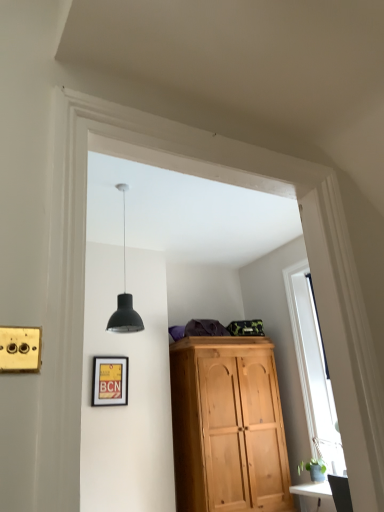
Question: Is matte black lampshade at center positioned behind matte yellow picture frame at lower left?

Choices:
 (A) yes
 (B) no

Answer: (B)

Question: Is matte black lampshade at center completely or partially outside of matte yellow picture frame at lower left?

Choices:
 (A) no
 (B) yes

Answer: (B)

Question: Does matte black lampshade at center have a greater width compared to matte yellow picture frame at lower left?

Choices:
 (A) no
 (B) yes

Answer: (A)

Question: Could you tell me if matte black lampshade at center is facing matte yellow picture frame at lower left?

Choices:
 (A) yes
 (B) no

Answer: (B)

Question: Does matte black lampshade at center lie in front of matte yellow picture frame at lower left?

Choices:
 (A) yes
 (B) no

Answer: (A)

Question: From the image's perspective, is matte black lampshade at center below matte yellow picture frame at lower left?

Choices:
 (A) yes
 (B) no

Answer: (B)

Question: From the image's perspective, is matte black lampshade at center over transparent glass window at right?

Choices:
 (A) no
 (B) yes

Answer: (B)

Question: Does matte black lampshade at center have a larger size compared to transparent glass window at right?

Choices:
 (A) no
 (B) yes

Answer: (A)

Question: Is matte black lampshade at center to the right of transparent glass window at right from the viewer's perspective?

Choices:
 (A) yes
 (B) no

Answer: (B)

Question: Is matte black lampshade at center facing towards transparent glass window at right?

Choices:
 (A) no
 (B) yes

Answer: (A)

Question: From a real-world perspective, is matte black lampshade at center on top of transparent glass window at right?

Choices:
 (A) no
 (B) yes

Answer: (B)

Question: Is matte black lampshade at center shorter than transparent glass window at right?

Choices:
 (A) no
 (B) yes

Answer: (B)

Question: Does matte yellow picture frame at lower left turn towards transparent glass window at right?

Choices:
 (A) yes
 (B) no

Answer: (B)